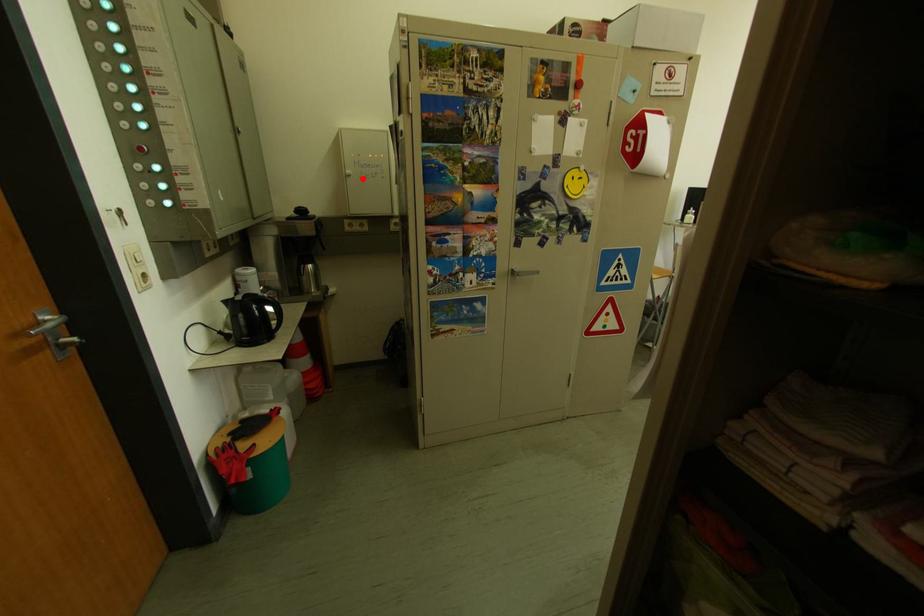
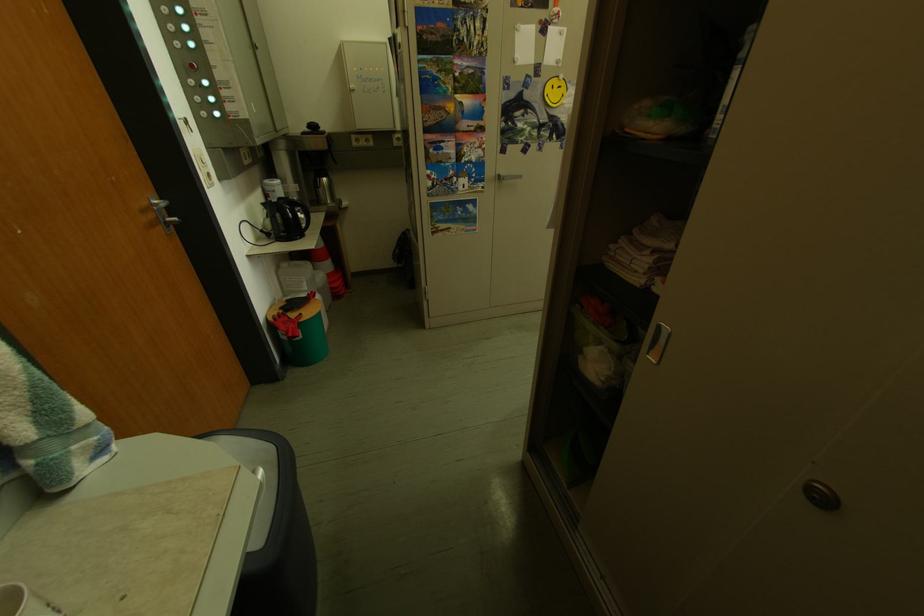
In the second image, find the point that corresponds to the highlighted location in the first image.

(367, 92)